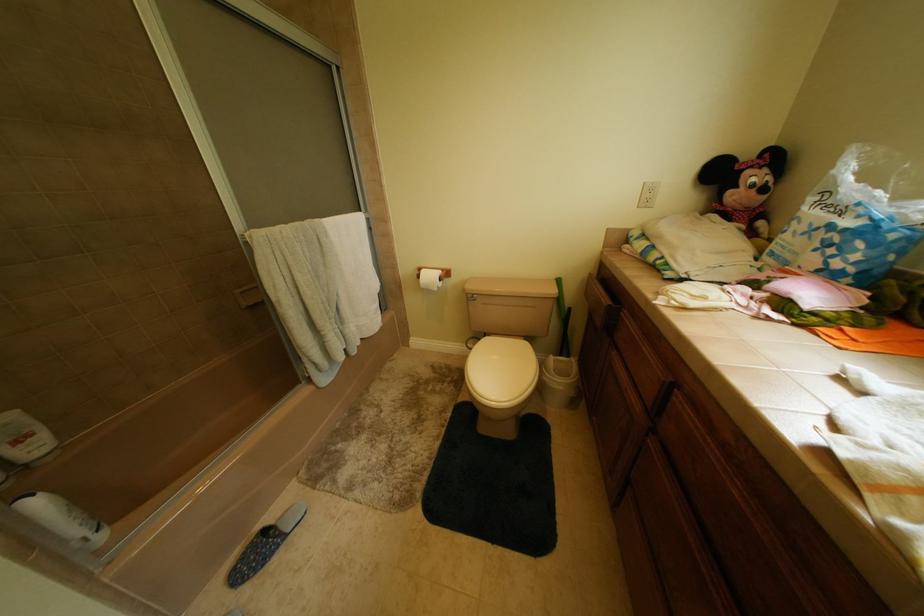
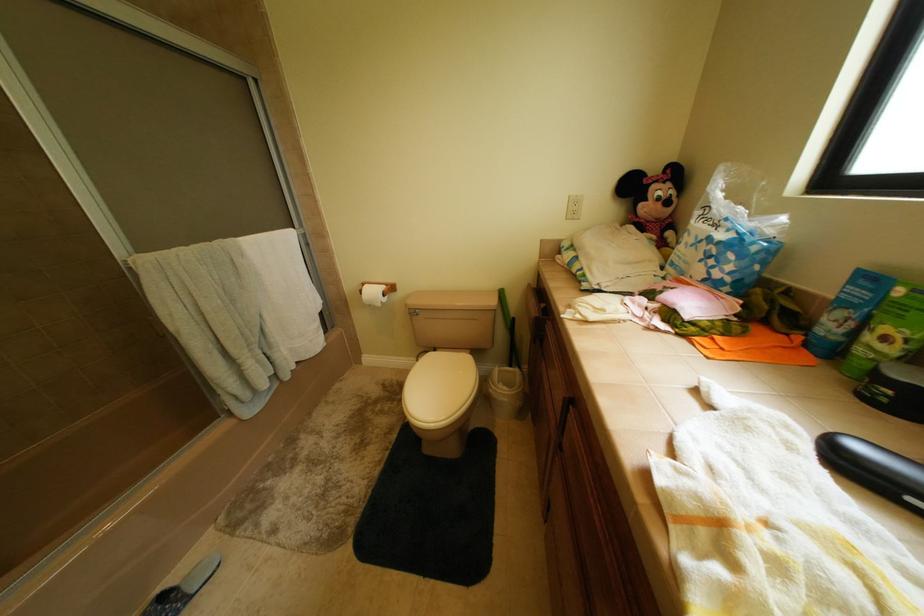
Question: The images are taken continuously from a first-person perspective. In which direction are you moving?

Choices:
 (A) Left
 (B) Right
 (C) Forward
 (D) Backward

Answer: (B)